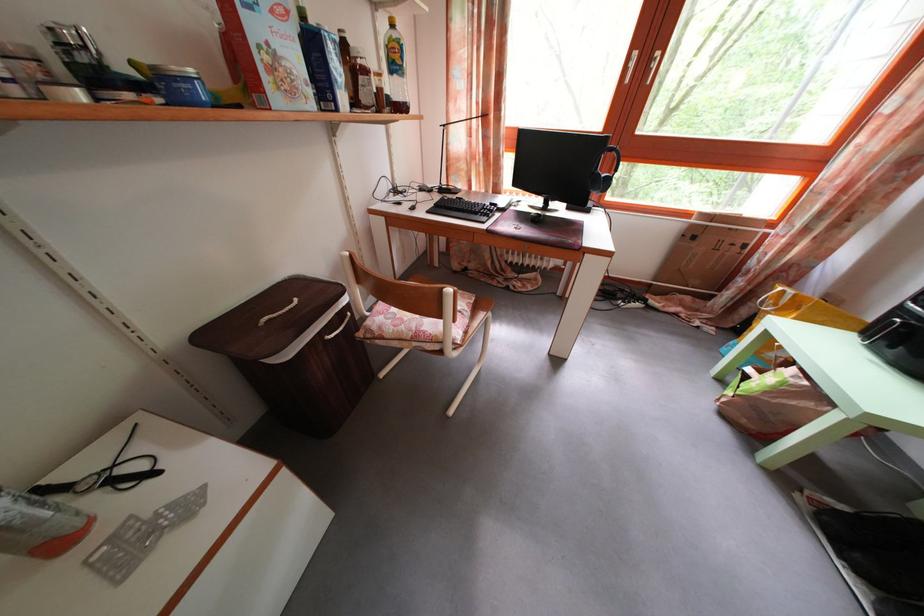
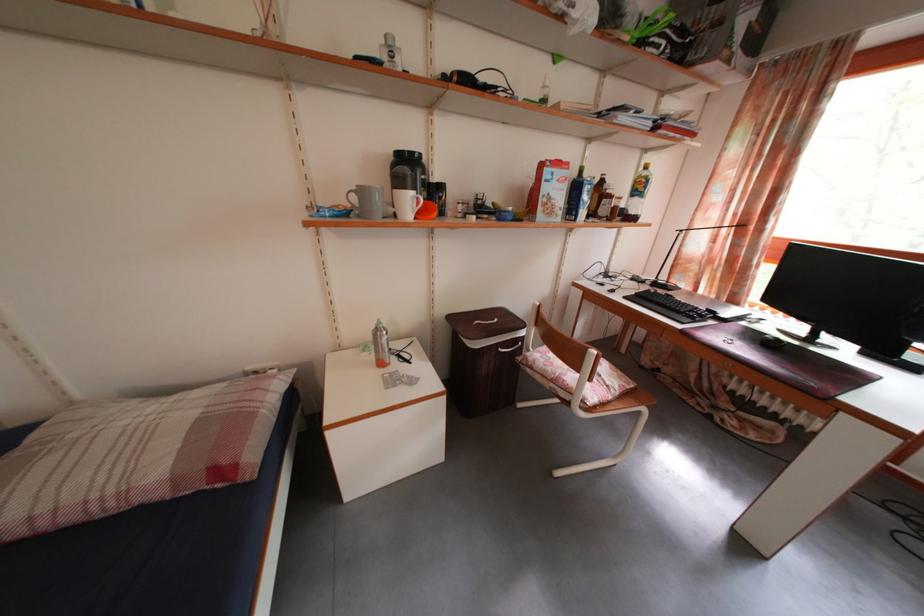
In the second image, find the point that corresponds to [527,216] in the first image.

(763, 334)